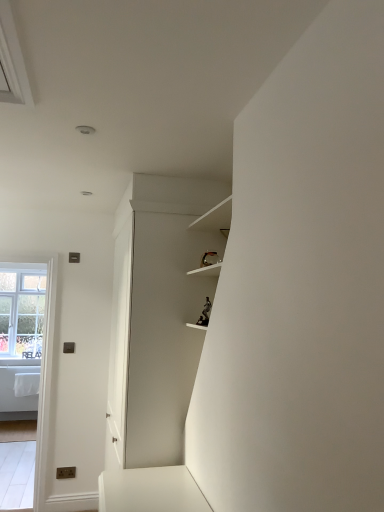
Question: Is clear glass window at left spatially inside clear glass window at left, or outside of it?

Choices:
 (A) outside
 (B) inside

Answer: (A)

Question: From a real-world perspective, is clear glass window at left positioned above or below clear glass window at left?

Choices:
 (A) above
 (B) below

Answer: (B)

Question: Which of these objects is positioned closest to the clear glass window at left?

Choices:
 (A) clear glass window at left
 (B) white matte cabinet at center

Answer: (A)

Question: Estimate the real-world distances between objects in this image. Which object is closer to the white matte cabinet at center?

Choices:
 (A) clear glass window at left
 (B) clear glass window at left

Answer: (A)